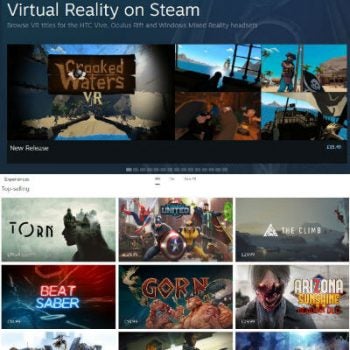
Where is `favorite counter`? This screenshot has width=350, height=350. favorite counter is located at coordinates (338, 147).